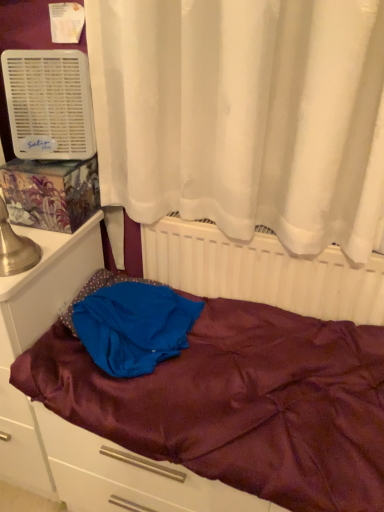
Question: From the image's perspective, would you say matte white file cabinet at left is positioned over maroon satin bed at center?

Choices:
 (A) no
 (B) yes

Answer: (A)

Question: Could you tell me if matte white file cabinet at left is facing maroon satin bed at center?

Choices:
 (A) no
 (B) yes

Answer: (A)

Question: Can you confirm if matte white file cabinet at left is thinner than maroon satin bed at center?

Choices:
 (A) no
 (B) yes

Answer: (A)

Question: Considering the relative sizes of matte white file cabinet at left and maroon satin bed at center in the image provided, is matte white file cabinet at left smaller than maroon satin bed at center?

Choices:
 (A) no
 (B) yes

Answer: (A)

Question: Is matte white file cabinet at left at the left side of maroon satin bed at center?

Choices:
 (A) yes
 (B) no

Answer: (A)

Question: Is matte white file cabinet at left far away from maroon satin bed at center?

Choices:
 (A) no
 (B) yes

Answer: (A)

Question: Is the depth of white plastic air conditioner at upper left less than that of blue satin blanket at center?

Choices:
 (A) yes
 (B) no

Answer: (B)

Question: Is white plastic air conditioner at upper left thinner than blue satin blanket at center?

Choices:
 (A) no
 (B) yes

Answer: (B)

Question: From the image's perspective, is white plastic air conditioner at upper left below blue satin blanket at center?

Choices:
 (A) no
 (B) yes

Answer: (A)

Question: Is white plastic air conditioner at upper left positioned behind blue satin blanket at center?

Choices:
 (A) yes
 (B) no

Answer: (A)

Question: Is white plastic air conditioner at upper left touching blue satin blanket at center?

Choices:
 (A) no
 (B) yes

Answer: (A)

Question: From a real-world perspective, is white plastic air conditioner at upper left beneath blue satin blanket at center?

Choices:
 (A) no
 (B) yes

Answer: (A)

Question: From the image's perspective, would you say white plastic air conditioner at upper left is positioned over maroon satin bed at center?

Choices:
 (A) yes
 (B) no

Answer: (A)